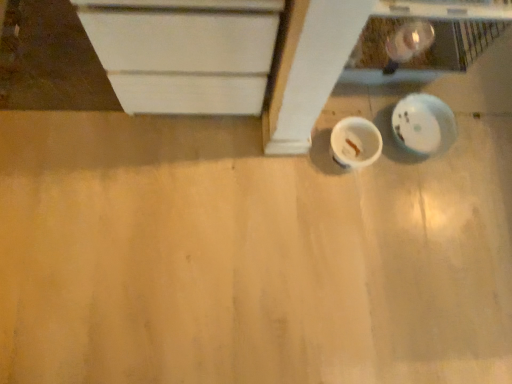
This screenshot has height=384, width=512. Find the location of `free location in front of white glossy plate at lower right`. free location in front of white glossy plate at lower right is located at coordinates (418, 192).